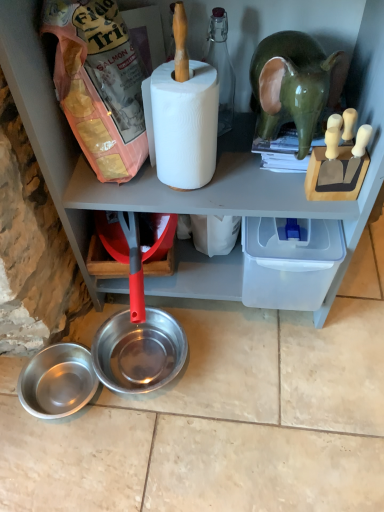
Identify the location of vacant space underneath brushed metal bowl at lower left, which appears as the 2th bowl when viewed from the right (from a real-world perspective). (66, 390).